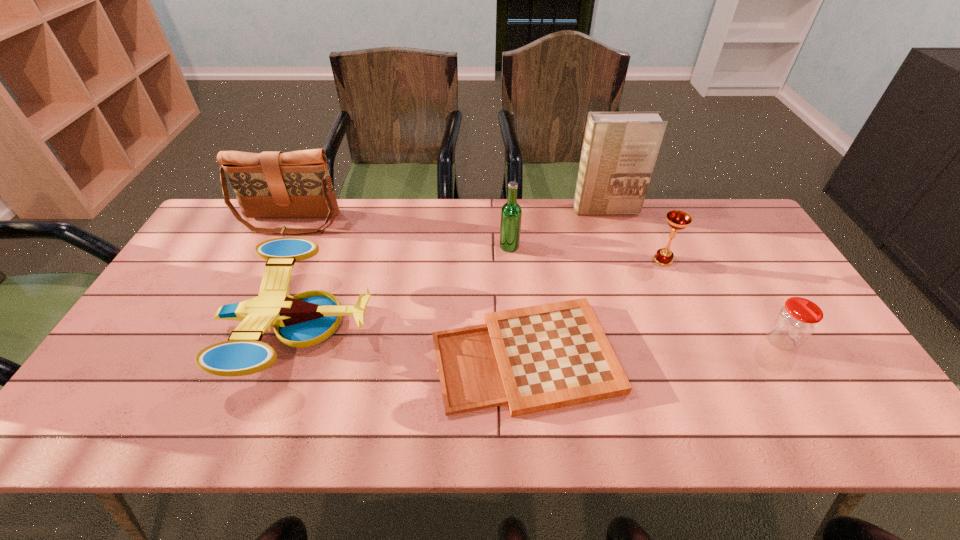
This screenshot has width=960, height=540. Find the location of `empty location between the shortest object and the jar`. empty location between the shortest object and the jar is located at coordinates coord(653,348).

At what (x,y) coordinates should I click in order to perform the action: click on free point between the drone and the beer bottle. Please return your answer as a coordinate pair (x, y). Looking at the image, I should click on (404, 287).

In order to click on free space between the fourth tallest object and the beer bottle in this screenshot , I will do `click(587, 253)`.

You are a GUI agent. You are given a task and a screenshot of the screen. Output one action in this format:
    pyautogui.click(x=<x>, y=<y>)
    Task: Click on the vacant space that is in between the rightmost object and the shoulder bag
    The width and height of the screenshot is (960, 540).
    Given the screenshot: What is the action you would take?
    pyautogui.click(x=536, y=281)

This screenshot has width=960, height=540. Identify the location of empty space between the gameboard and the shoulder bag. (408, 288).

Where is `free spot between the shortest object and the tallest object`? The image size is (960, 540). free spot between the shortest object and the tallest object is located at coordinates (564, 282).

I want to click on empty space between the fourth tallest object and the phonebook, so click(x=634, y=235).

This screenshot has width=960, height=540. I want to click on vacant space that's between the drone and the fourth shortest object, so click(x=481, y=293).

Find the location of `the fourth closest object relative to the gameboard`. the fourth closest object relative to the gameboard is located at coordinates (795, 321).

You are a GUI agent. You are given a task and a screenshot of the screen. Output one action in this format:
    pyautogui.click(x=<x>, y=<y>)
    Task: Click on the closest object relative to the drone
    
    Given the screenshot: What is the action you would take?
    pyautogui.click(x=272, y=184)